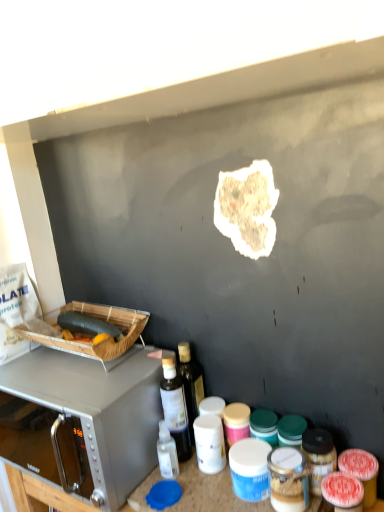
The height and width of the screenshot is (512, 384). Find the location of `vacant area that is in front of green matte zucchini at left, arranged as the first food when viewed from the left`. vacant area that is in front of green matte zucchini at left, arranged as the first food when viewed from the left is located at coordinates (81, 374).